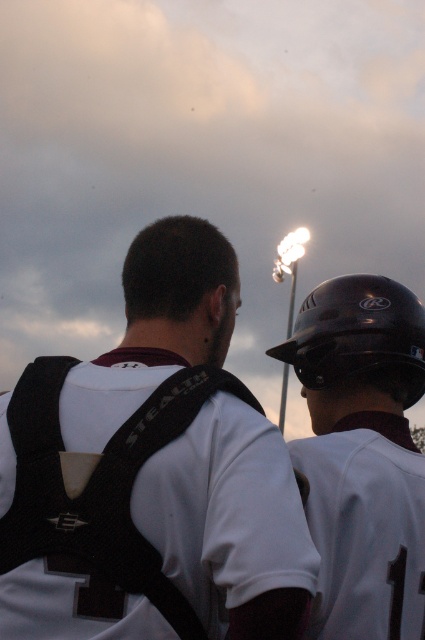
Question: Among these objects, which one is nearest to the camera?

Choices:
 (A) white jersey at upper right
 (B) matte black helmet at upper right
 (C) black matte helmet at upper right

Answer: (B)

Question: Which of these objects is positioned closest to the matte black helmet at upper right?

Choices:
 (A) black matte helmet at upper right
 (B) white jersey at upper right

Answer: (B)

Question: Considering the real-world distances, which object is farthest from the black matte helmet at upper right?

Choices:
 (A) white jersey at upper right
 (B) matte black helmet at upper right

Answer: (B)

Question: Can you confirm if white jersey at upper right is thinner than black matte helmet at upper right?

Choices:
 (A) no
 (B) yes

Answer: (B)

Question: Does matte black helmet at upper right appear on the left side of white jersey at upper right?

Choices:
 (A) no
 (B) yes

Answer: (B)

Question: Does matte black helmet at upper right appear on the left side of white jersey at upper right?

Choices:
 (A) no
 (B) yes

Answer: (B)